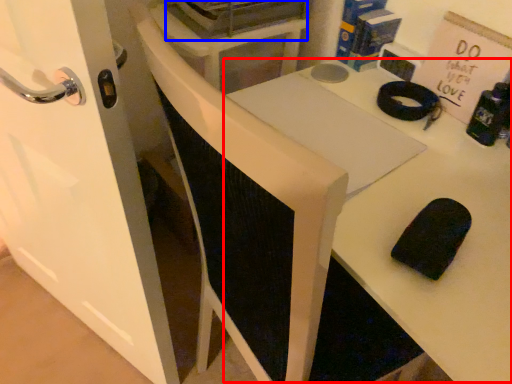
Question: Which object is closer to the camera taking this photo, table (highlighted by a red box) or appliance (highlighted by a blue box)?

Choices:
 (A) table
 (B) appliance

Answer: (A)